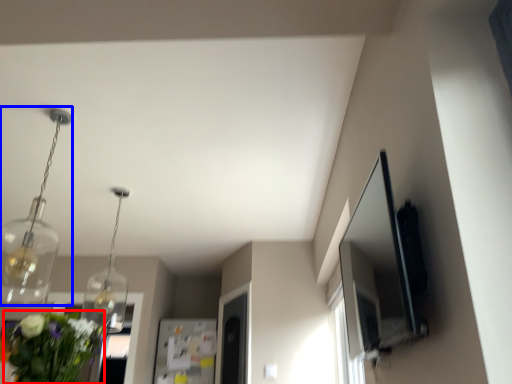
Question: Which point is closer to the camera, floral arrangement (highlighted by a red box) or light fixture (highlighted by a blue box)?

Choices:
 (A) floral arrangement
 (B) light fixture

Answer: (A)